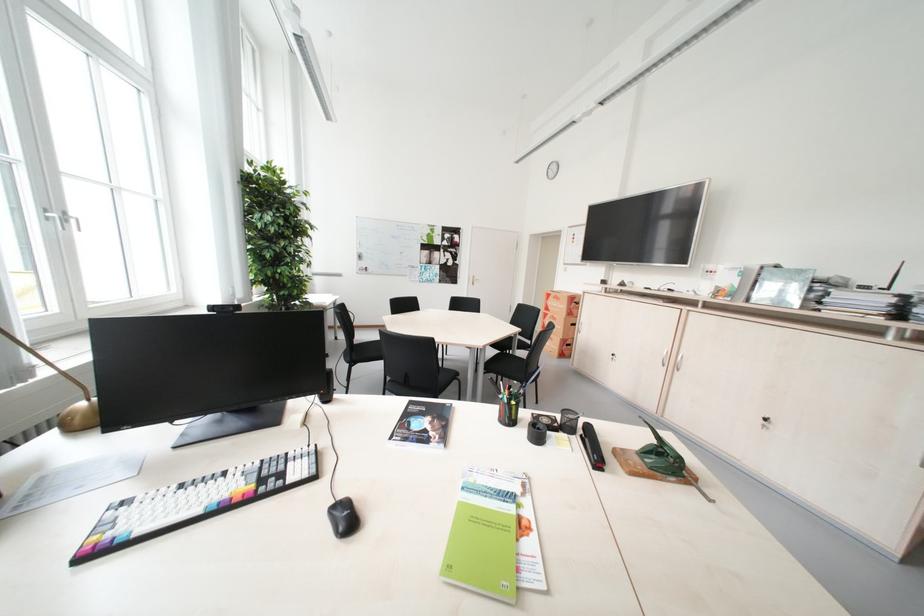
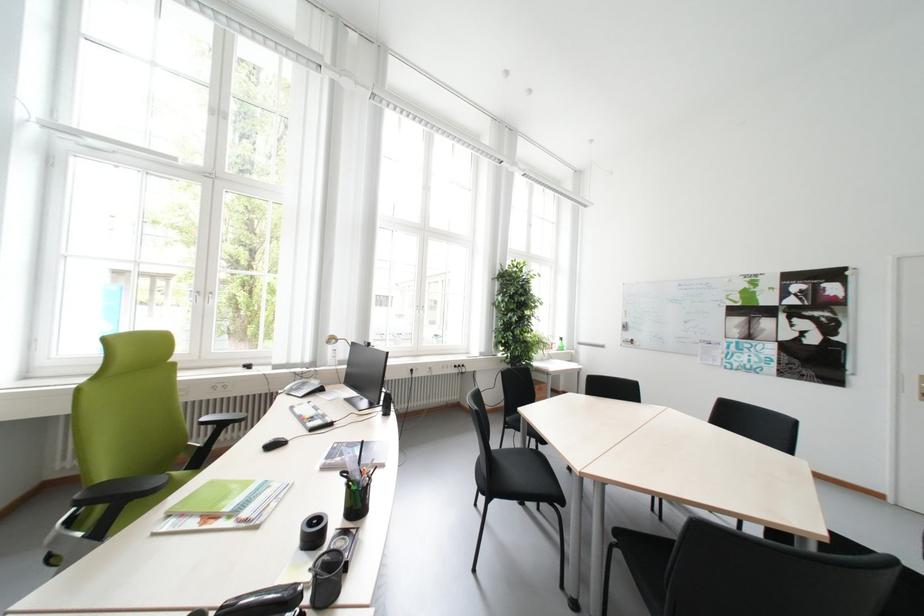
The point at (358, 265) is marked in the first image. Where is the corresponding point in the second image?

(621, 338)